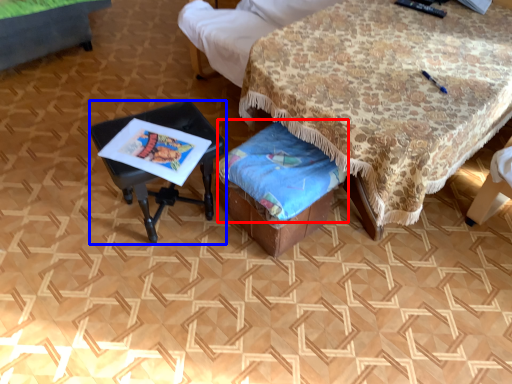
Question: Which object appears farthest to the camera in this image, blanket (highlighted by a red box) or table (highlighted by a blue box)?

Choices:
 (A) blanket
 (B) table

Answer: (B)